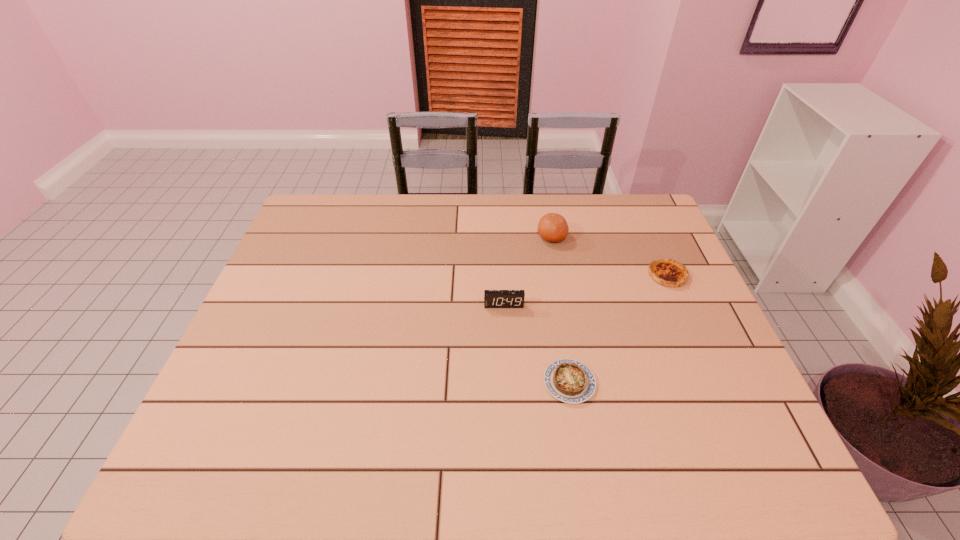
Identify the location of empty space between the farthest object and the third nearest object. (610, 256).

Identify the location of empty space that is in between the third farthest object and the left quiche. (537, 343).

The height and width of the screenshot is (540, 960). I want to click on vacant area between the left quiche and the third shortest object, so click(x=537, y=343).

Find the location of a particular element. free space between the farther quiche and the nearest object is located at coordinates point(618,329).

Identify the location of free spot between the left quiche and the tallest object. The height and width of the screenshot is (540, 960). (561, 310).

Where is `empty space that is in between the nearest object and the tallest object`? This screenshot has width=960, height=540. empty space that is in between the nearest object and the tallest object is located at coordinates (561, 310).

Find the location of a particular element. The width and height of the screenshot is (960, 540). unoccupied area between the third shortest object and the farthest object is located at coordinates (528, 271).

The image size is (960, 540). I want to click on empty location between the clementine and the farther quiche, so click(610, 256).

Find the location of `object that is the third closest one to the rightmost object`. object that is the third closest one to the rightmost object is located at coordinates (492, 298).

Where is `object that is the closest to the left quiche`? object that is the closest to the left quiche is located at coordinates (492, 298).